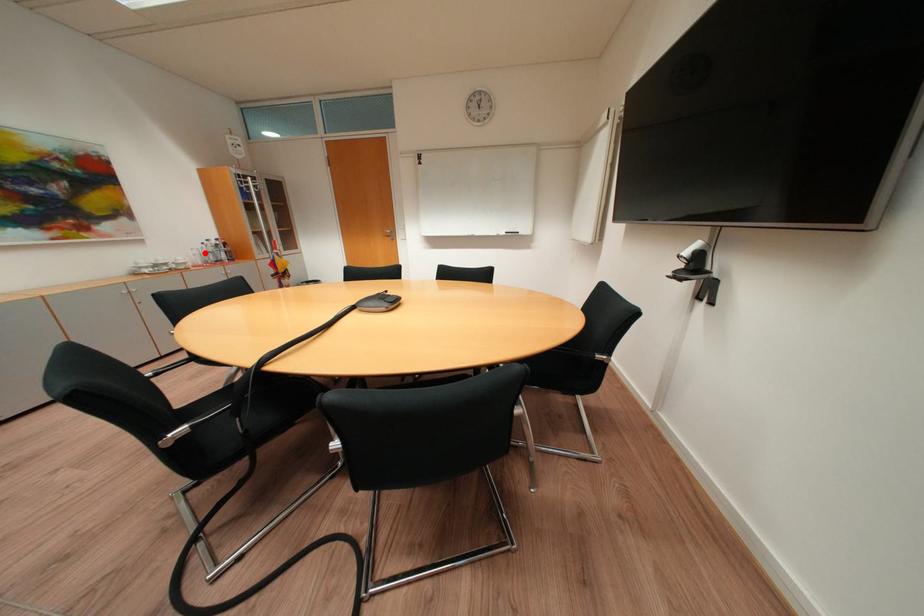
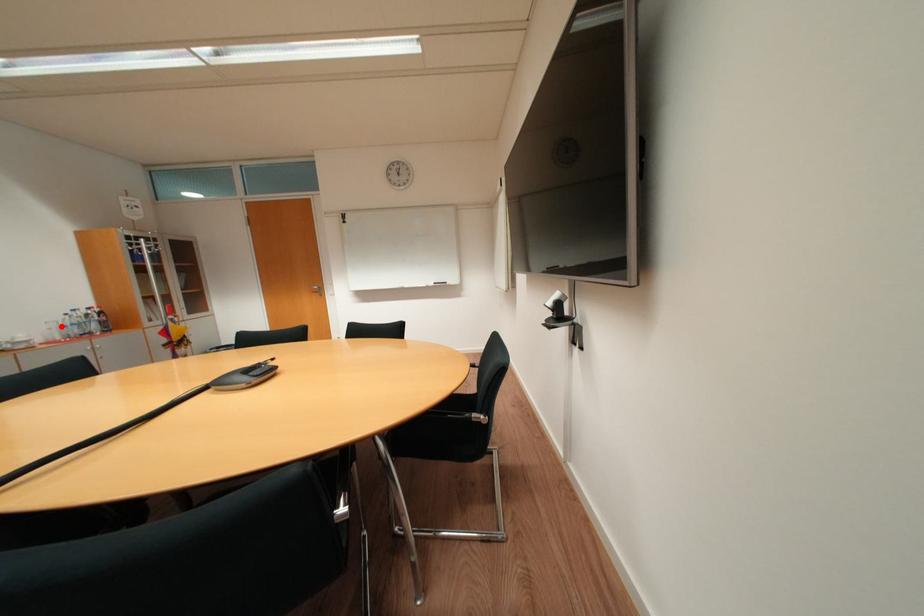
I am providing you with two images of the same scene from different viewpoints. A red point is marked on the first image and another point is marked on the second image. Is the marked point in image1 the same physical position as the marked point in image2?

Yes